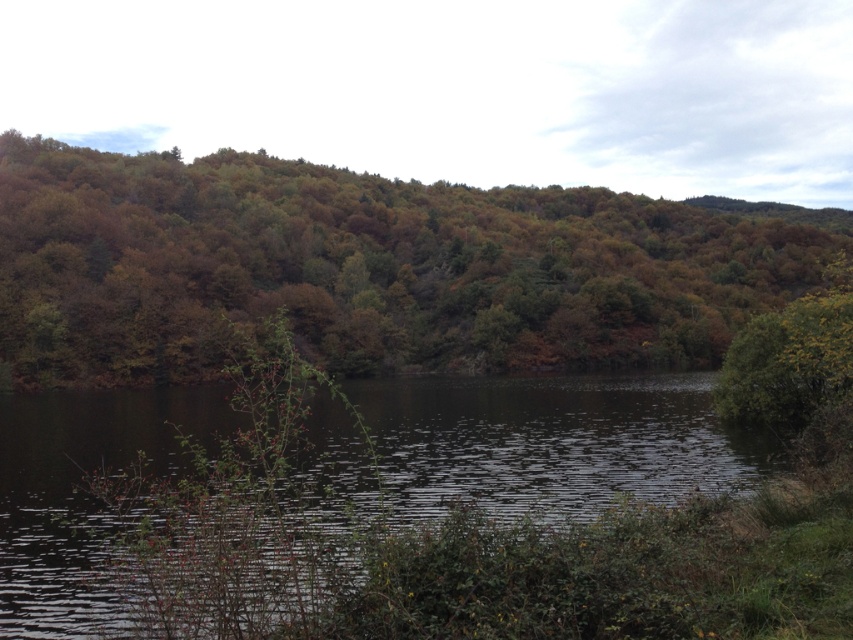
You are standing at the edge of the dark reflective water at center and want to walk to the green matte tree at center. Based on their sizes, which one do you think is wider?

The green matte tree at center might be wider than dark reflective water at center according to the description.